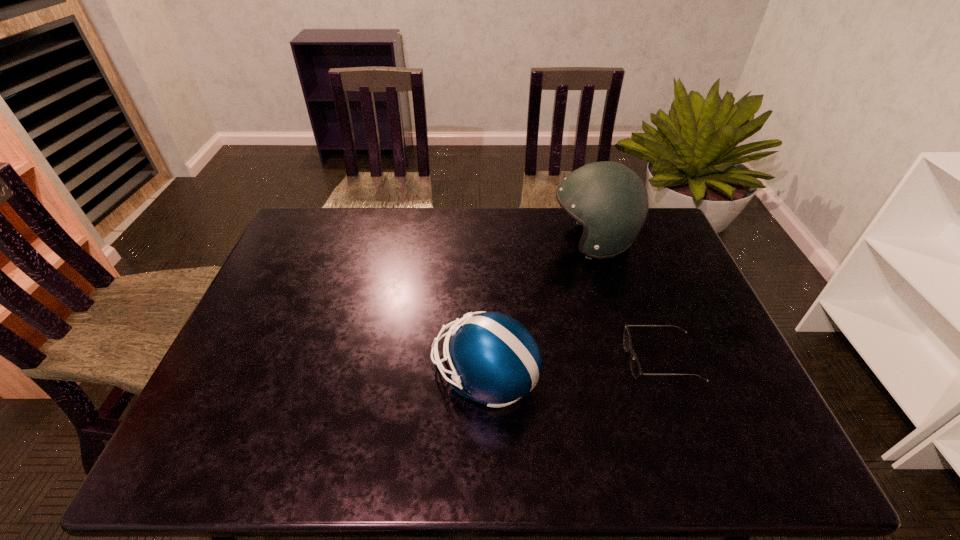
The image size is (960, 540). What are the coordinates of `vacant space located 0.280m at the front of the second shortest object with the faceguard` in the screenshot? It's located at (315, 375).

I want to click on free location located through the lenses of the spectacles, so click(x=547, y=360).

Where is `vacant space located 0.390m through the lenses of the spectacles`? The height and width of the screenshot is (540, 960). vacant space located 0.390m through the lenses of the spectacles is located at coordinates (471, 360).

Identify the location of free location located 0.080m through the lenses of the spectacles. This screenshot has height=540, width=960. (595, 360).

Identify the location of object that is at the far edge. Image resolution: width=960 pixels, height=540 pixels. (609, 199).

Locate an element on the screen. football helmet present at the right edge is located at coordinates (609, 199).

This screenshot has width=960, height=540. What are the coordinates of `spectacles at the right edge` in the screenshot? It's located at (635, 367).

You are a GUI agent. You are given a task and a screenshot of the screen. Output one action in this format:
    pyautogui.click(x=<x>, y=<y>)
    Task: Click on the object that is at the far right corner
    The height and width of the screenshot is (540, 960).
    Given the screenshot: What is the action you would take?
    pyautogui.click(x=609, y=199)

In the image, there is a desktop. At what (x,y) coordinates should I click in order to perform the action: click on vacant region at the far edge. Please return your answer as a coordinate pair (x, y). Looking at the image, I should click on (404, 237).

In the image, there is a desktop. At what (x,y) coordinates should I click in order to perform the action: click on vacant space at the near edge. Please return your answer as a coordinate pair (x, y). The height and width of the screenshot is (540, 960). Looking at the image, I should click on (687, 441).